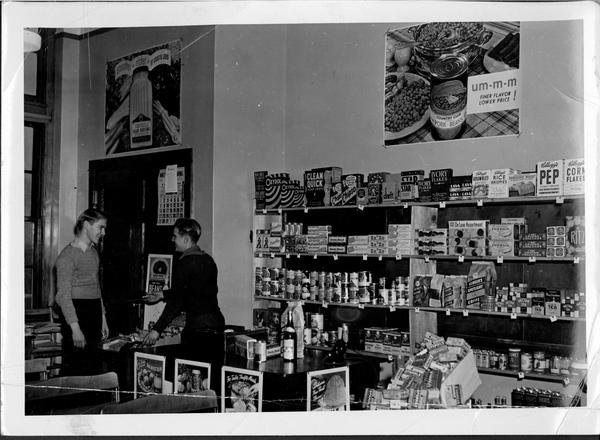
The height and width of the screenshot is (440, 600). I want to click on poster, so click(x=412, y=104).